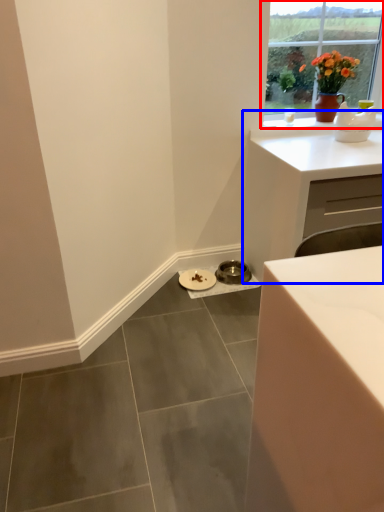
Question: Which object appears closest to the camera in this image, window (highlighted by a red box) or cabinetry (highlighted by a blue box)?

Choices:
 (A) window
 (B) cabinetry

Answer: (B)